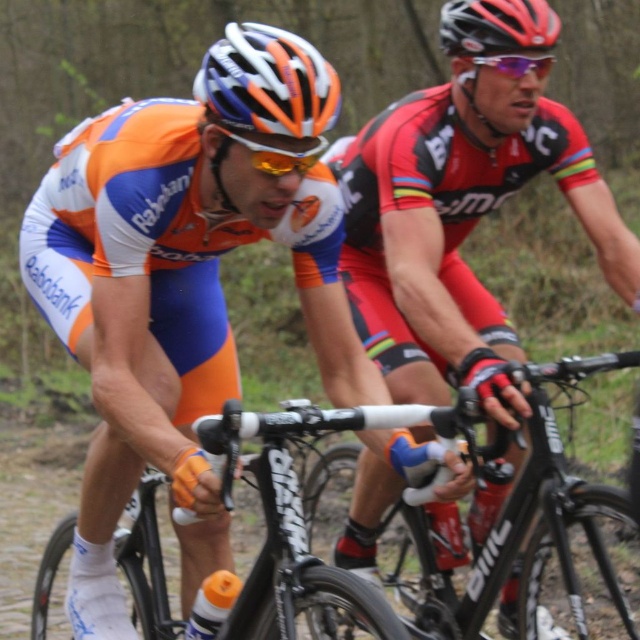
Question: Which of the following is the closest to the observer?

Choices:
 (A) white matte bicycle helmet at upper center
 (B) black matte bicycle helmet at upper center
 (C) black matte helmet at upper center

Answer: (A)

Question: Can you confirm if matte black jersey at center is bigger than white matte bicycle handlebars at center?

Choices:
 (A) no
 (B) yes

Answer: (B)

Question: Which of the following is the farthest from the observer?

Choices:
 (A) black matte bicycle helmet at upper center
 (B) matte black jersey at center

Answer: (A)

Question: Considering the relative positions of black matte bicycle at center and white matte bicycle handlebars at center in the image provided, where is black matte bicycle at center located with respect to white matte bicycle handlebars at center?

Choices:
 (A) above
 (B) below

Answer: (A)

Question: Which point is closer to the camera taking this photo?

Choices:
 (A) (230, 24)
 (B) (470, 52)

Answer: (A)

Question: Is white matte bicycle helmet at upper center to the left of black matte helmet at upper center from the viewer's perspective?

Choices:
 (A) no
 (B) yes

Answer: (B)